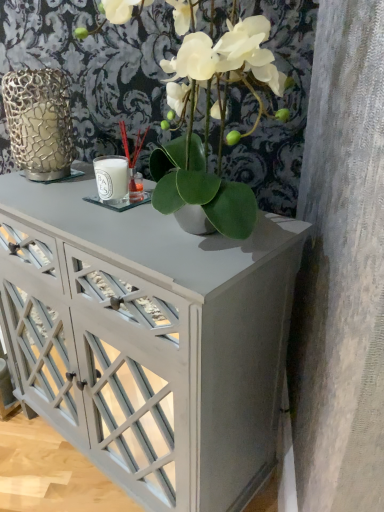
Question: Considering the relative positions of green matte plant at center and gold textured vase at left in the image provided, is green matte plant at center to the left of gold textured vase at left from the viewer's perspective?

Choices:
 (A) yes
 (B) no

Answer: (B)

Question: Is green matte plant at center oriented away from gold textured vase at left?

Choices:
 (A) no
 (B) yes

Answer: (A)

Question: Is there a large distance between green matte plant at center and gold textured vase at left?

Choices:
 (A) no
 (B) yes

Answer: (A)

Question: Is green matte plant at center aimed at gold textured vase at left?

Choices:
 (A) no
 (B) yes

Answer: (A)

Question: From the image's perspective, is green matte plant at center beneath gold textured vase at left?

Choices:
 (A) no
 (B) yes

Answer: (B)

Question: From a real-world perspective, relative to green matte plant at center, is white glossy cabinet at center vertically above or below?

Choices:
 (A) above
 (B) below

Answer: (B)

Question: From their relative heights in the image, would you say white glossy cabinet at center is taller or shorter than green matte plant at center?

Choices:
 (A) tall
 (B) short

Answer: (A)

Question: Is white glossy cabinet at center wider or thinner than green matte plant at center?

Choices:
 (A) thin
 (B) wide

Answer: (A)

Question: Based on their positions, is white glossy cabinet at center located to the left or right of green matte plant at center?

Choices:
 (A) left
 (B) right

Answer: (A)

Question: In the image, is gold textured vase at left positioned in front of or behind green matte plant at center?

Choices:
 (A) behind
 (B) front

Answer: (A)

Question: Considering the positions of gold textured vase at left and green matte plant at center in the image, is gold textured vase at left wider or thinner than green matte plant at center?

Choices:
 (A) thin
 (B) wide

Answer: (A)

Question: From their relative heights in the image, would you say gold textured vase at left is taller or shorter than green matte plant at center?

Choices:
 (A) short
 (B) tall

Answer: (A)

Question: Does point (46, 175) appear closer or farther from the camera than point (117, 18)?

Choices:
 (A) farther
 (B) closer

Answer: (A)

Question: Is green matte plant at center situated inside gold textured vase at left or outside?

Choices:
 (A) outside
 (B) inside

Answer: (A)

Question: Based on their positions, is green matte plant at center located to the left or right of gold textured vase at left?

Choices:
 (A) right
 (B) left

Answer: (A)